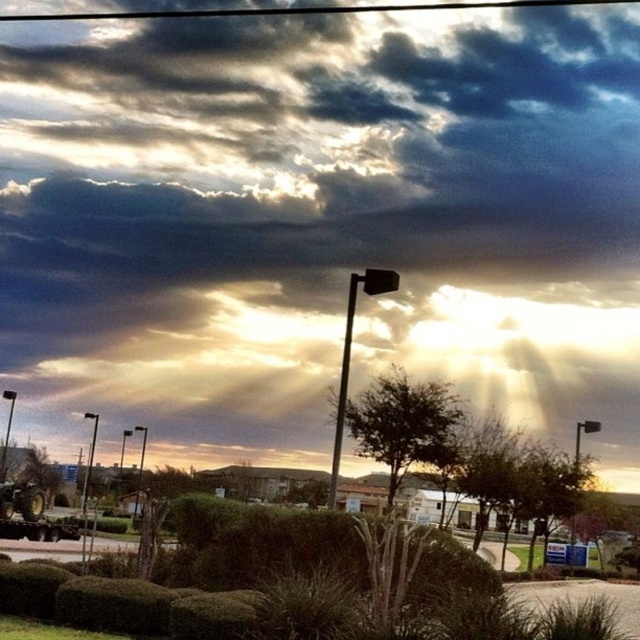
Question: Is cloudy sky at upper center thinner than black metal pole at center?

Choices:
 (A) no
 (B) yes

Answer: (A)

Question: Among these points, which one is nearest to the camera?

Choices:
 (A) (348, 289)
 (B) (552, 273)

Answer: (A)

Question: Is cloudy sky at upper center behind black metal pole at center?

Choices:
 (A) no
 (B) yes

Answer: (B)

Question: Which point is farther to the camera?

Choices:
 (A) (84, 536)
 (B) (332, 458)

Answer: (B)

Question: Is cloudy sky at upper center above metallic pole at upper left?

Choices:
 (A) yes
 (B) no

Answer: (A)

Question: Which object is positioned closest to the metallic pole at upper left?

Choices:
 (A) black metal pole at center
 (B) cloudy sky at upper center

Answer: (A)